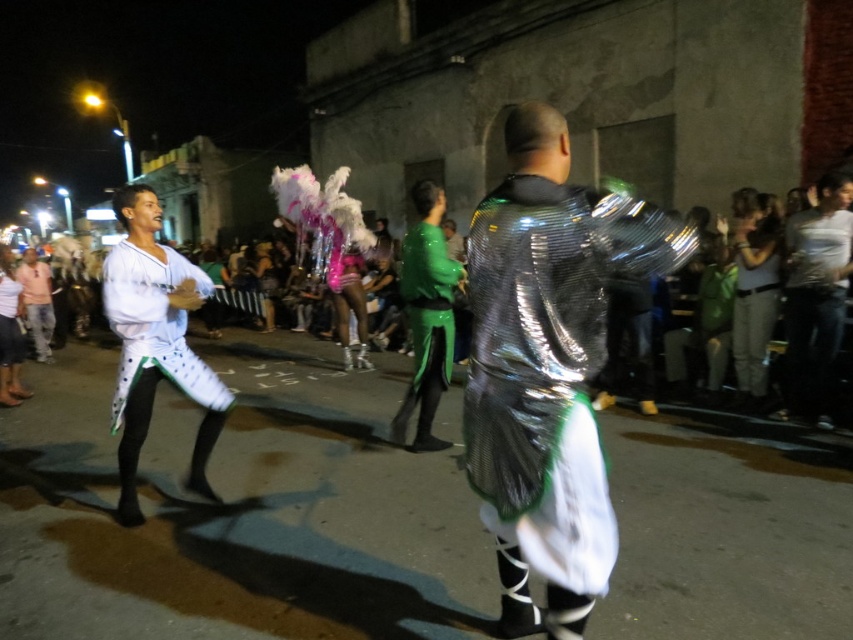
Question: Which of the following is the closest to the observer?

Choices:
 (A) (422, 340)
 (B) (45, 360)
 (C) (578, 212)
 (D) (117, 257)

Answer: (C)

Question: Which of the following is the closest to the observer?

Choices:
 (A) matte green pants at lower center
 (B) shiny metallic jacket at center
 (C) white matte pants at center

Answer: (B)

Question: Is white matte shirt at right smaller than white matte pants at center?

Choices:
 (A) no
 (B) yes

Answer: (B)

Question: Which point appears farthest from the camera in this image?

Choices:
 (A) (790, 388)
 (B) (421, 259)

Answer: (A)

Question: Is shiny metallic jacket at center to the left of green glossy suit at center from the viewer's perspective?

Choices:
 (A) no
 (B) yes

Answer: (A)

Question: Observing the image, what is the correct spatial positioning of white matte pants at center in reference to green glossy suit at center?

Choices:
 (A) right
 (B) left

Answer: (B)